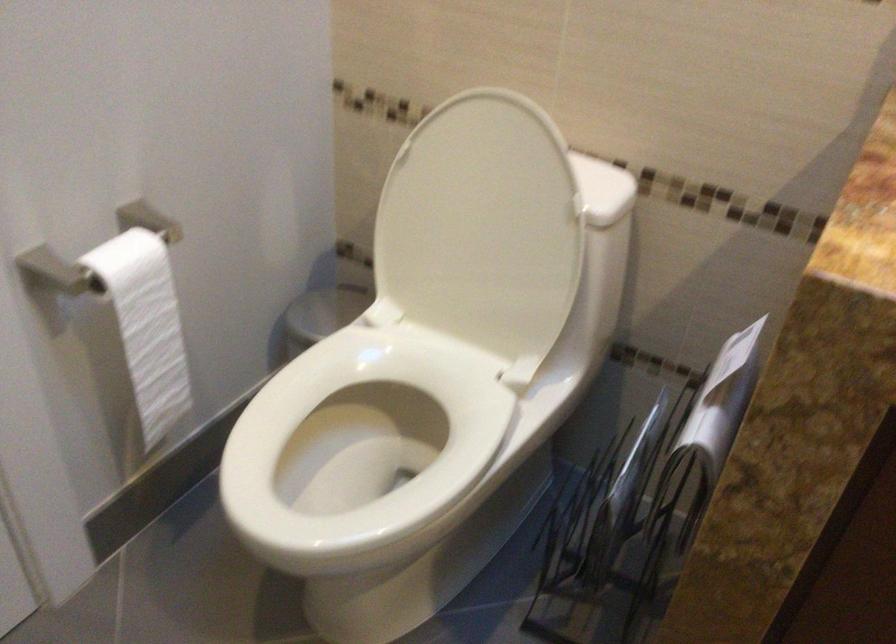
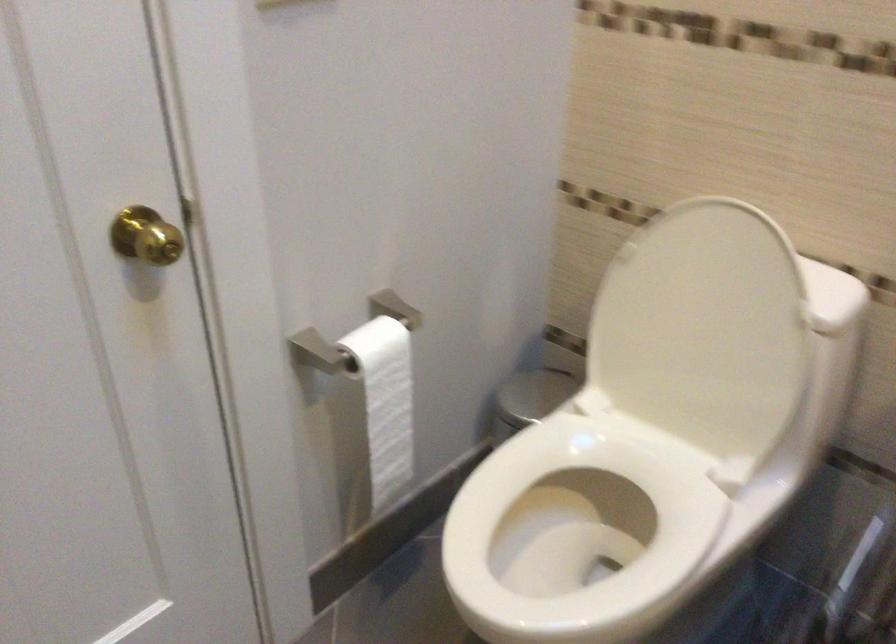
Question: I am providing you with two images of the same scene from different viewpoints. Which of the following objects are not visible in image2?

Choices:
 (A) toilet seat
 (B) trash can lid
 (C) toilet paper roll
 (D) none of these

Answer: (D)